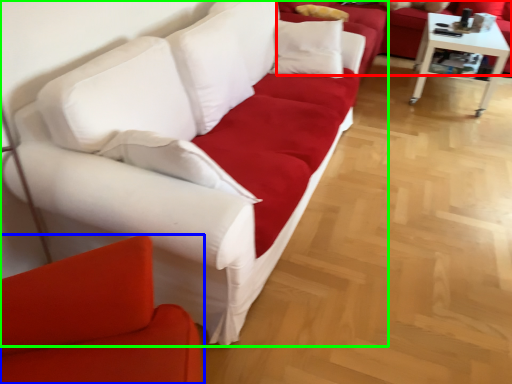
Question: Estimate the real-world distances between objects in this image. Which object is closer to studio couch (highlighted by a red box), studio couch (highlighted by a blue box) or studio couch (highlighted by a green box)?

Choices:
 (A) studio couch
 (B) studio couch

Answer: (B)